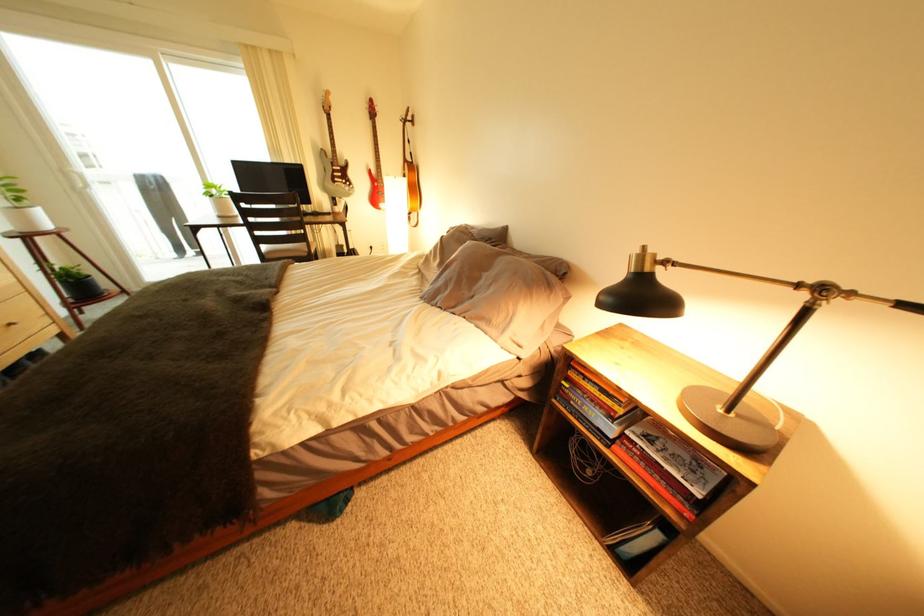
What are the coordinates of `acoustic guitar` in the screenshot? It's located at (334, 160).